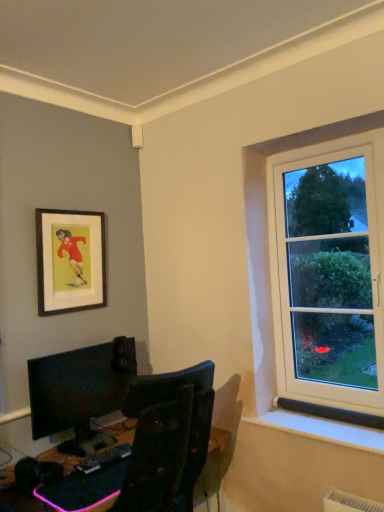
Find the location of a particular element. This screenshot has height=512, width=384. free space on the front side of black plastic keyboard at lower center is located at coordinates (99, 483).